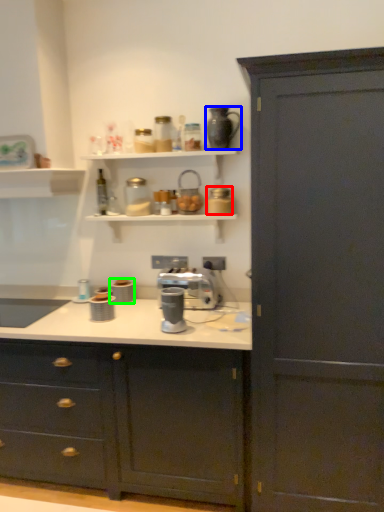
Question: Which object is positioned farthest from appliance (highlighted by a red box)? Select from coffeepot (highlighted by a blue box) and appliance (highlighted by a green box).

Choices:
 (A) coffeepot
 (B) appliance

Answer: (B)